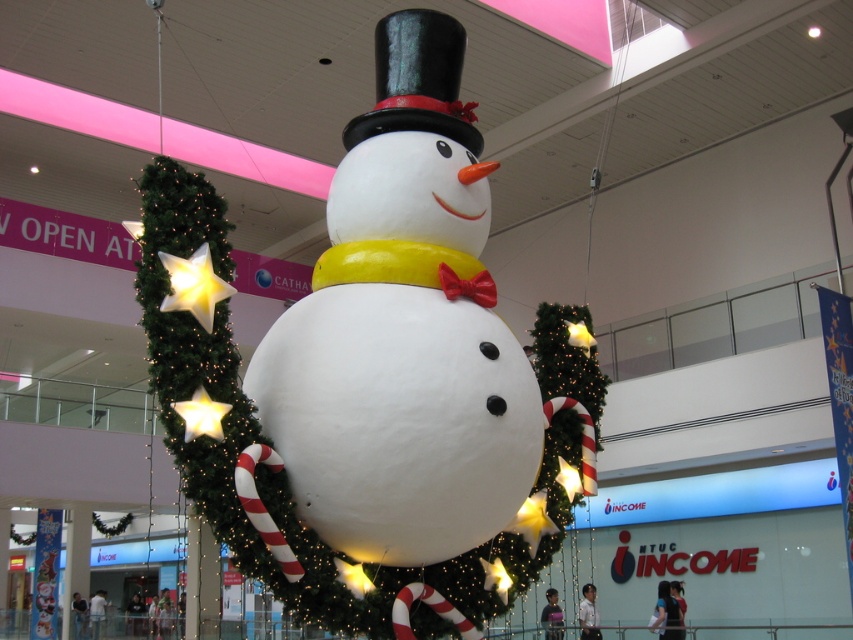
Is the position of white matte snowman at center less distant than that of shiny black hat at upper center?

Yes, it is.

Who is more forward, (518, 392) or (433, 64)?

Positioned in front is point (518, 392).

Which is in front, point (486, 412) or point (376, 102)?

Point (486, 412) is in front.

Where is `white matte snowman at center`? This screenshot has height=640, width=853. white matte snowman at center is located at coordinates (416, 356).